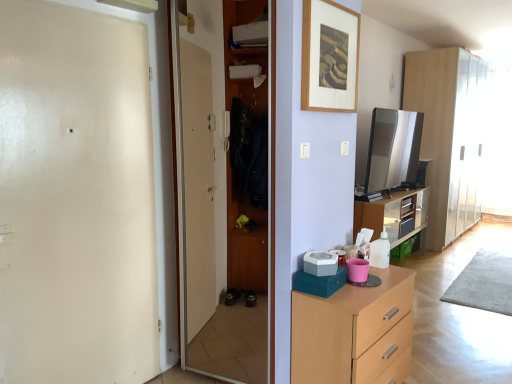
Question: From a real-world perspective, is white glossy door at left, which is counted as the 1th screen door, starting from the left, physically located above or below light wood chest of drawers at lower right?

Choices:
 (A) below
 (B) above

Answer: (B)

Question: Is white glossy door at left, which is counted as the 1th screen door, starting from the left, inside or outside of light wood chest of drawers at lower right?

Choices:
 (A) outside
 (B) inside

Answer: (A)

Question: Which object is positioned closest to the white plastic pet feeder at center, which is the second appliance from top to bottom?

Choices:
 (A) wooden wardrobe at center, which is counted as the first screen door, starting from the right
 (B) white glossy door at left, the 2th screen door positioned from the right
 (C) wooden picture frame at upper center
 (D) light wood cupboard at right
 (E) light wood chest of drawers at lower right

Answer: (E)

Question: Estimate the real-world distances between objects in this image. Which object is closer to the white plastic pet feeder at center, arranged as the second appliance when viewed from the right?

Choices:
 (A) white glossy door at left, the 2th screen door positioned from the right
 (B) light wood chest of drawers at lower right
 (C) wooden wardrobe at center, which is counted as the first screen door, starting from the right
 (D) wooden picture frame at upper center
 (E) satin silver tv at upper right, which appears as the 1th appliance when viewed from the top

Answer: (B)